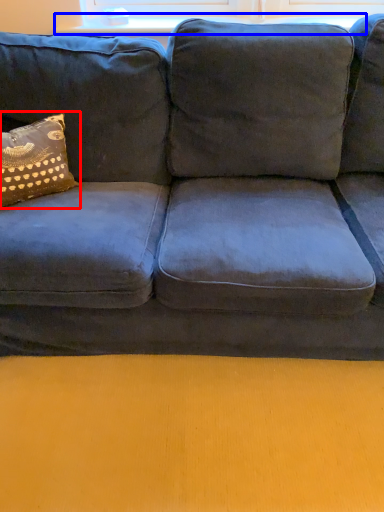
Question: Which of the following is the farthest to the observer, pillow (highlighted by a red box) or window sill (highlighted by a blue box)?

Choices:
 (A) pillow
 (B) window sill

Answer: (B)